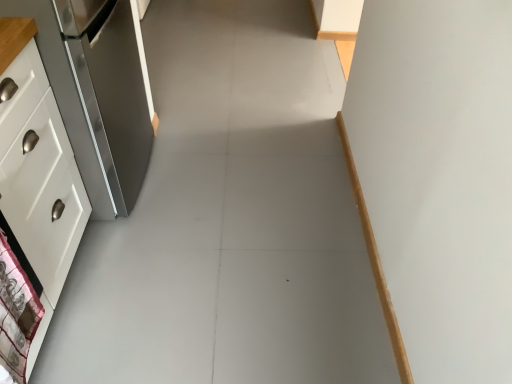
Identify the location of satin silver refrigerator at left. Image resolution: width=512 pixels, height=384 pixels. (96, 92).

From the image's perspective, which one is positioned lower, satin silver refrigerator at left or white fabric with pattern at lower left?

white fabric with pattern at lower left is shown below in the image.

Between satin silver refrigerator at left and white fabric with pattern at lower left, which one has larger size?

satin silver refrigerator at left.

From a real-world perspective, between satin silver refrigerator at left and white fabric with pattern at lower left, who is vertically lower?

satin silver refrigerator at left.

Between satin silver refrigerator at left and white fabric with pattern at lower left, which one has smaller width?

white fabric with pattern at lower left.

Considering the sizes of objects white fabric with pattern at lower left and satin silver refrigerator at left in the image provided, who is bigger, white fabric with pattern at lower left or satin silver refrigerator at left?

satin silver refrigerator at left is bigger.

Considering the sizes of objects white fabric with pattern at lower left and satin silver refrigerator at left in the image provided, who is taller, white fabric with pattern at lower left or satin silver refrigerator at left?

With more height is satin silver refrigerator at left.

Which of these two, white fabric with pattern at lower left or satin silver refrigerator at left, is wider?

Wider between the two is satin silver refrigerator at left.

Where is `material on the right of satin silver refrigerator at left`? This screenshot has height=384, width=512. material on the right of satin silver refrigerator at left is located at coordinates [16, 313].

Looking at this image, is satin silver refrigerator at left to the right of white glossy cabinet at left from the viewer's perspective?

Yes.

Identify the location of cabinetry located in front of the satin silver refrigerator at left. Image resolution: width=512 pixels, height=384 pixels. (37, 170).

Considering the relative sizes of satin silver refrigerator at left and white glossy cabinet at left in the image provided, is satin silver refrigerator at left smaller than white glossy cabinet at left?

Incorrect, satin silver refrigerator at left is not smaller in size than white glossy cabinet at left.

Would you consider satin silver refrigerator at left to be distant from white glossy cabinet at left?

No, there isn't a large distance between satin silver refrigerator at left and white glossy cabinet at left.

Does white glossy cabinet at left have a smaller size compared to satin silver refrigerator at left?

Yes.

Can you confirm if white glossy cabinet at left is wider than satin silver refrigerator at left?

No.

Are white glossy cabinet at left and satin silver refrigerator at left making contact?

No, white glossy cabinet at left is not making contact with satin silver refrigerator at left.

From the image's perspective, does white glossy cabinet at left appear lower than satin silver refrigerator at left?

Yes.

Locate an element on the screen. material behind the white glossy cabinet at left is located at coordinates (16, 313).

Which is correct: white glossy cabinet at left is inside white fabric with pattern at lower left, or outside of it?

white glossy cabinet at left cannot be found inside white fabric with pattern at lower left.

Between white glossy cabinet at left and white fabric with pattern at lower left, which one is positioned in front?

white glossy cabinet at left is more forward.

Considering the relative sizes of white glossy cabinet at left and white fabric with pattern at lower left in the image provided, is white glossy cabinet at left shorter than white fabric with pattern at lower left?

Incorrect, the height of white glossy cabinet at left does not fall short of that of white fabric with pattern at lower left.

Is white fabric with pattern at lower left taller or shorter than white glossy cabinet at left?

In the image, white fabric with pattern at lower left appears to be shorter than white glossy cabinet at left.

Between white fabric with pattern at lower left and white glossy cabinet at left, which one has smaller width?

With smaller width is white fabric with pattern at lower left.

How many degrees apart are the facing directions of white fabric with pattern at lower left and white glossy cabinet at left?

They differ by 0.164 degrees in their facing directions.

The width and height of the screenshot is (512, 384). I want to click on refrigerator located behind the white fabric with pattern at lower left, so click(x=96, y=92).

Identify the location of refrigerator that is on the left side of white fabric with pattern at lower left. (96, 92).

Based on their spatial positions, is white fabric with pattern at lower left or satin silver refrigerator at left closer to white glossy cabinet at left?

white fabric with pattern at lower left lies closer to white glossy cabinet at left than the other object.

Estimate the real-world distances between objects in this image. Which object is further from white glossy cabinet at left, satin silver refrigerator at left or white fabric with pattern at lower left?

satin silver refrigerator at left is positioned further to the anchor white glossy cabinet at left.

From the image, which object appears to be nearer to white fabric with pattern at lower left, satin silver refrigerator at left or white glossy cabinet at left?

The object closer to white fabric with pattern at lower left is white glossy cabinet at left.

Consider the image. Considering their positions, is white fabric with pattern at lower left positioned closer to satin silver refrigerator at left than white glossy cabinet at left?

Among the two, white glossy cabinet at left is located nearer to satin silver refrigerator at left.

Looking at the image, which one is located closer to satin silver refrigerator at left, white glossy cabinet at left or white fabric with pattern at lower left?

white glossy cabinet at left is positioned closer to the anchor satin silver refrigerator at left.

Which object lies nearer to the anchor point white fabric with pattern at lower left, white glossy cabinet at left or satin silver refrigerator at left?

white glossy cabinet at left is closer to white fabric with pattern at lower left.

Find the location of `cabinetry between satin silver refrigerator at left and white fabric with pattern at lower left in the up-down direction`. cabinetry between satin silver refrigerator at left and white fabric with pattern at lower left in the up-down direction is located at coordinates (37, 170).